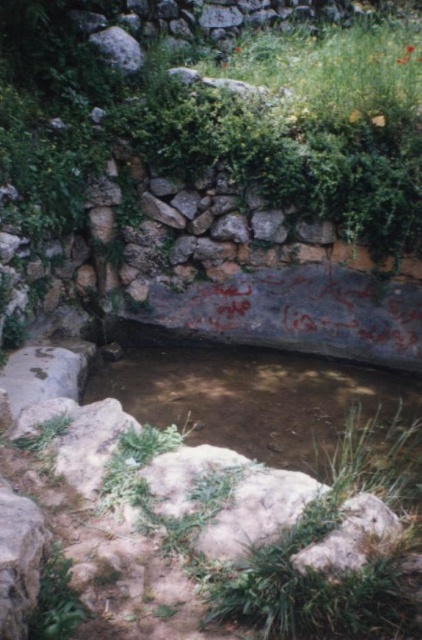
Question: Which point is closer to the camera?

Choices:
 (A) green leafy plant at upper center
 (B) brown murky water at center

Answer: (B)

Question: In this image, where is green leafy plant at upper center located relative to brown murky water at center?

Choices:
 (A) left
 (B) right

Answer: (A)

Question: Does green leafy plant at upper center appear on the left side of brown murky water at center?

Choices:
 (A) yes
 (B) no

Answer: (A)

Question: Which object is farther from the camera taking this photo?

Choices:
 (A) green leafy plant at upper center
 (B) brown murky water at center

Answer: (A)

Question: Which point is farther from the camera taking this photo?

Choices:
 (A) (275, 392)
 (B) (111, 141)

Answer: (B)

Question: Can you confirm if green leafy plant at upper center is positioned above brown murky water at center?

Choices:
 (A) yes
 (B) no

Answer: (A)